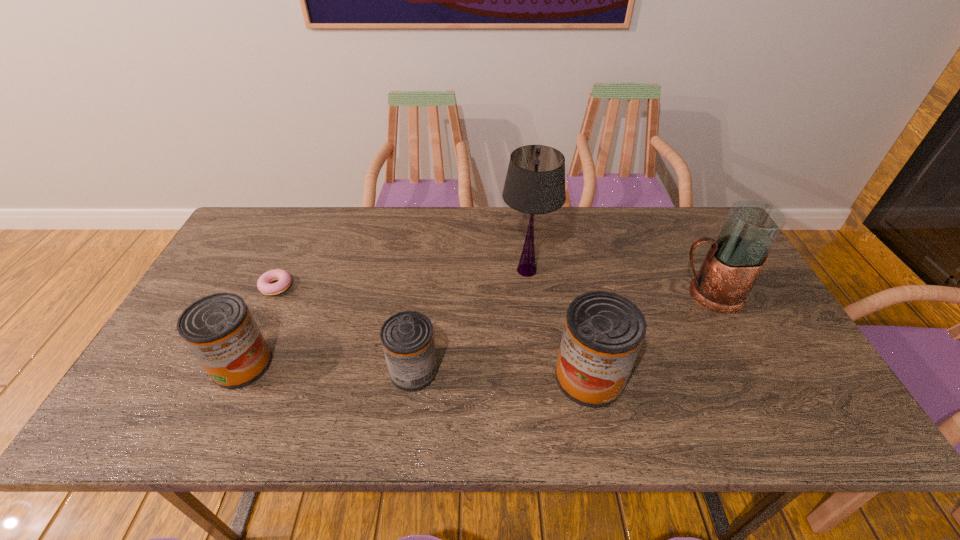
Locate which can is the second closest to the pitcher. Please provide its 2D coordinates. Your answer should be formatted as a tuple, i.e. [(x, y)], where the tuple contains the x and y coordinates of a point satisfying the conditions above.

[(407, 338)]

Where is `can that stands as the second closest to the second shortest can`? can that stands as the second closest to the second shortest can is located at coordinates [603, 332].

This screenshot has width=960, height=540. I want to click on free location that satisfies the following two spatial constraints: 1. on the front-facing side of the rightmost can; 2. on the right side of the tallest object, so click(539, 377).

At what (x,y) coordinates should I click in order to perform the action: click on free spot that satisfies the following two spatial constraints: 1. on the front side of the second tallest can; 2. on the left side of the rightmost can. Please return your answer as a coordinate pair (x, y). Looking at the image, I should click on (236, 377).

Identify the location of vacant space that satisfies the following two spatial constraints: 1. with the handle on the side of the rightmost object; 2. on the front side of the second can from left to right. (747, 371).